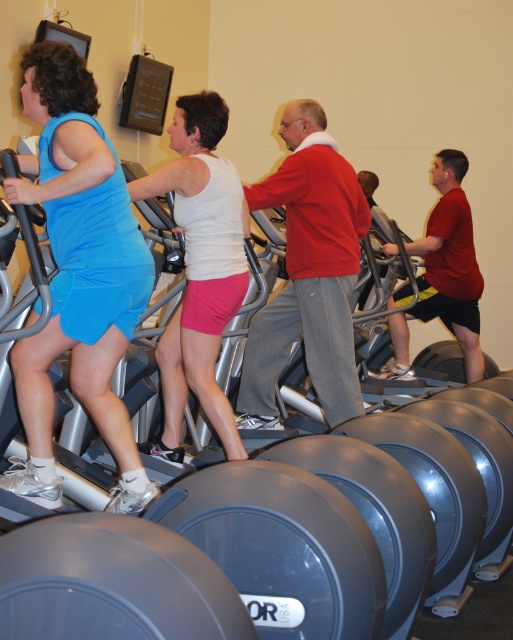
You are a gym trainer observing the elliptical machine users. You notice the red cotton sweater at center and the white matte tank top at center. Which clothing item takes up more space in the image?

The red cotton sweater at center is bigger than the white matte tank top at center, so it takes up more space in the image.